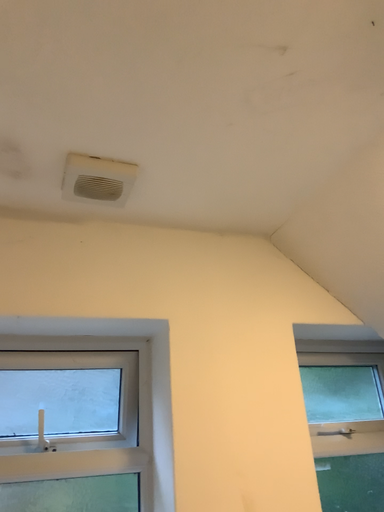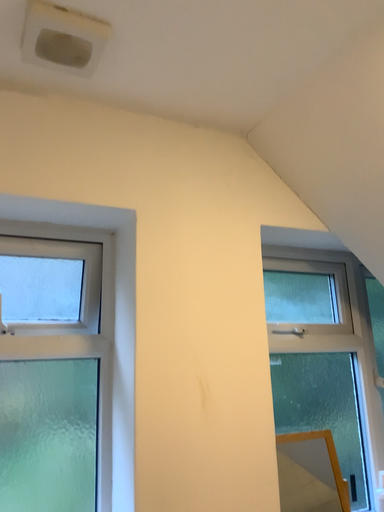
Question: Which way did the camera rotate in the video?

Choices:
 (A) rotated upward
 (B) rotated downward

Answer: (B)